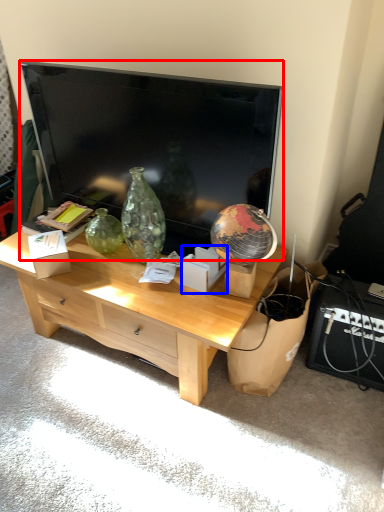
Question: Which of the following is the closest to the observer, television (highlighted by a red box) or cardboard box (highlighted by a blue box)?

Choices:
 (A) television
 (B) cardboard box

Answer: (A)